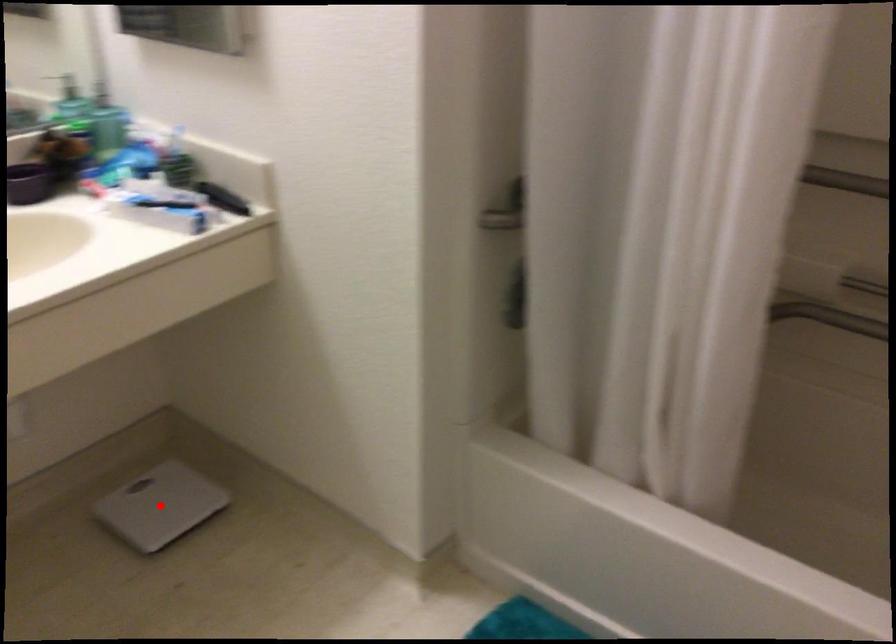
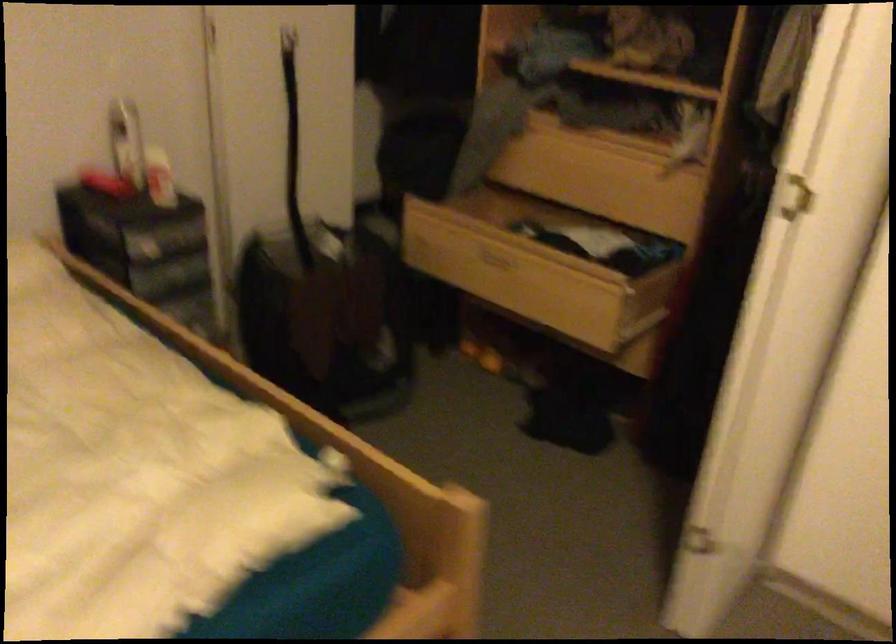
Question: I am providing you with two images of the same scene from different viewpoints. A red point is marked on the first image. Is the red point's position out of view in image 2?

Choices:
 (A) Yes
 (B) No

Answer: (A)